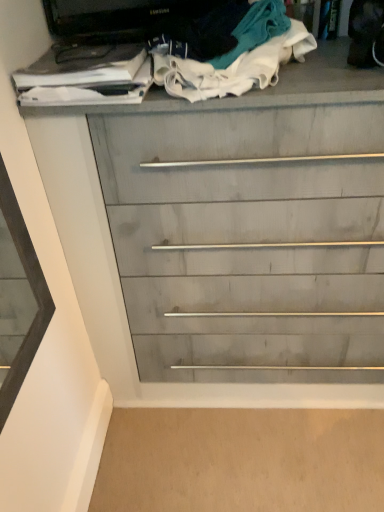
What do you see at coordinates (212, 208) in the screenshot? The width and height of the screenshot is (384, 512). I see `gray wood chest of drawers at center` at bounding box center [212, 208].

This screenshot has height=512, width=384. What are the coordinates of `white cotton cloth at upper center, the first clothing in the right-to-left sequence` in the screenshot? It's located at (235, 56).

Image resolution: width=384 pixels, height=512 pixels. Identify the location of gray wood chest of drawers at center. (212, 208).

From a real-world perspective, is white cotton cloth at upper center, the first clothing in the right-to-left sequence, located beneath gray wood chest of drawers at center?

Actually, white cotton cloth at upper center, the first clothing in the right-to-left sequence, is physically above gray wood chest of drawers at center in the real world.

Can you see white cotton cloth at upper center, arranged as the 2th clothing when viewed from the left, touching gray wood chest of drawers at center?

No, white cotton cloth at upper center, arranged as the 2th clothing when viewed from the left, is not touching gray wood chest of drawers at center.

Is gray wood chest of drawers at center inside white cotton cloth at upper center, arranged as the 2th clothing when viewed from the left?

No, gray wood chest of drawers at center is not surrounded by white cotton cloth at upper center, arranged as the 2th clothing when viewed from the left.

Considering the relative positions of gray wood chest of drawers at center and white cotton cloth at upper center, the first clothing in the right-to-left sequence, in the image provided, is gray wood chest of drawers at center behind white cotton cloth at upper center, the first clothing in the right-to-left sequence,?

Yes, gray wood chest of drawers at center is further from the viewer.

From the image's perspective, does gray wood chest of drawers at center appear higher than white cotton cloth at upper center, arranged as the 2th clothing when viewed from the left?

No, from the image's perspective, gray wood chest of drawers at center is not on top of white cotton cloth at upper center, arranged as the 2th clothing when viewed from the left.

Considering the points (86, 304) and (261, 64), which point is in front, point (86, 304) or point (261, 64)?

The point (261, 64) is more forward.

Is gray wood chest of drawers at center positioned far away from white cotton cloth at upper center, the first clothing in the right-to-left sequence?

No.

In the scene shown: From a real-world perspective, is white cotton socks at upper center, which ranks as the first clothing in left-to-right order, located beneath white cotton cloth at upper center, arranged as the 2th clothing when viewed from the left?

Yes.

From the picture: Is white cotton socks at upper center, which is counted as the 2th clothing, starting from the right, closer to camera compared to white cotton cloth at upper center, arranged as the 2th clothing when viewed from the left?

No, white cotton socks at upper center, which is counted as the 2th clothing, starting from the right, is further to the viewer.

Is point (81, 87) farther from viewer compared to point (242, 52)?

No.

Are white cotton socks at upper center, which is counted as the 2th clothing, starting from the right, and white cotton cloth at upper center, arranged as the 2th clothing when viewed from the left, far apart?

That's not correct — white cotton socks at upper center, which is counted as the 2th clothing, starting from the right, is a little close to white cotton cloth at upper center, arranged as the 2th clothing when viewed from the left.

Considering the sizes of white cotton socks at upper center, which ranks as the first clothing in left-to-right order, and gray wood chest of drawers at center in the image, is white cotton socks at upper center, which ranks as the first clothing in left-to-right order, taller or shorter than gray wood chest of drawers at center?

In the image, white cotton socks at upper center, which ranks as the first clothing in left-to-right order, appears to be shorter than gray wood chest of drawers at center.

From a real-world perspective, who is located higher, white cotton socks at upper center, which is counted as the 2th clothing, starting from the right, or gray wood chest of drawers at center?

white cotton socks at upper center, which is counted as the 2th clothing, starting from the right, is physically above.

Which is nearer, (112, 68) or (287, 120)?

The point (112, 68) is more forward.

Consider the image. Are white cotton socks at upper center, which is counted as the 2th clothing, starting from the right, and gray wood chest of drawers at center located far from each other?

That's not correct — white cotton socks at upper center, which is counted as the 2th clothing, starting from the right, is a little close to gray wood chest of drawers at center.

Considering the relative sizes of gray wood chest of drawers at center and white cotton socks at upper center, which is counted as the 2th clothing, starting from the right, in the image provided, is gray wood chest of drawers at center smaller than white cotton socks at upper center, which is counted as the 2th clothing, starting from the right,?

No.

Is gray wood chest of drawers at center oriented away from white cotton socks at upper center, which is counted as the 2th clothing, starting from the right?

No, gray wood chest of drawers at center is not facing the opposite direction of white cotton socks at upper center, which is counted as the 2th clothing, starting from the right.

Which point is more distant from viewer, (35, 123) or (102, 76)?

The point (35, 123) is farther.

Is point (176, 44) closer to camera compared to point (129, 69)?

No.

Considering the relative positions of white cotton cloth at upper center, the first clothing in the right-to-left sequence, and white cotton socks at upper center, which is counted as the 2th clothing, starting from the right, in the image provided, is white cotton cloth at upper center, the first clothing in the right-to-left sequence, to the left of white cotton socks at upper center, which is counted as the 2th clothing, starting from the right, from the viewer's perspective?

Incorrect, white cotton cloth at upper center, the first clothing in the right-to-left sequence, is not on the left side of white cotton socks at upper center, which is counted as the 2th clothing, starting from the right.

The height and width of the screenshot is (512, 384). Find the location of `clothing that is above the white cotton socks at upper center, which is counted as the 2th clothing, starting from the right (from a real-world perspective)`. clothing that is above the white cotton socks at upper center, which is counted as the 2th clothing, starting from the right (from a real-world perspective) is located at coordinates (235, 56).

From a real-world perspective, who is located lower, white cotton cloth at upper center, arranged as the 2th clothing when viewed from the left, or white cotton socks at upper center, which is counted as the 2th clothing, starting from the right?

white cotton socks at upper center, which is counted as the 2th clothing, starting from the right, is physically lower.

Where is `the 2nd clothing above the gray wood chest of drawers at center (from a real-world perspective)`? the 2nd clothing above the gray wood chest of drawers at center (from a real-world perspective) is located at coordinates (235, 56).

In the image, there is a white cotton cloth at upper center, the first clothing in the right-to-left sequence. Identify the location of the chest of drawers below it (from a real-world perspective). The image size is (384, 512). (212, 208).

Looking at the image, which one is located closer to gray wood chest of drawers at center, white cotton cloth at upper center, arranged as the 2th clothing when viewed from the left, or white cotton socks at upper center, which is counted as the 2th clothing, starting from the right?

Based on the image, white cotton cloth at upper center, arranged as the 2th clothing when viewed from the left, appears to be nearer to gray wood chest of drawers at center.

In the scene shown: When comparing their distances from white cotton socks at upper center, which ranks as the first clothing in left-to-right order, does gray wood chest of drawers at center or white cotton cloth at upper center, arranged as the 2th clothing when viewed from the left, seem further?

The object further to white cotton socks at upper center, which ranks as the first clothing in left-to-right order, is gray wood chest of drawers at center.

In the scene shown: When comparing their distances from white cotton cloth at upper center, arranged as the 2th clothing when viewed from the left, does white cotton socks at upper center, which ranks as the first clothing in left-to-right order, or gray wood chest of drawers at center seem further?

gray wood chest of drawers at center.

Estimate the real-world distances between objects in this image. Which object is closer to white cotton socks at upper center, which is counted as the 2th clothing, starting from the right, white cotton cloth at upper center, the first clothing in the right-to-left sequence, or gray wood chest of drawers at center?

Based on the image, white cotton cloth at upper center, the first clothing in the right-to-left sequence, appears to be nearer to white cotton socks at upper center, which is counted as the 2th clothing, starting from the right.

Looking at the image, which one is located closer to white cotton cloth at upper center, arranged as the 2th clothing when viewed from the left, gray wood chest of drawers at center or white cotton socks at upper center, which is counted as the 2th clothing, starting from the right?

white cotton socks at upper center, which is counted as the 2th clothing, starting from the right, lies closer to white cotton cloth at upper center, arranged as the 2th clothing when viewed from the left, than the other object.

Which object lies further to the anchor point gray wood chest of drawers at center, white cotton socks at upper center, which ranks as the first clothing in left-to-right order, or white cotton cloth at upper center, the first clothing in the right-to-left sequence?

Based on the image, white cotton socks at upper center, which ranks as the first clothing in left-to-right order, appears to be further to gray wood chest of drawers at center.

The height and width of the screenshot is (512, 384). I want to click on clothing situated between white cotton socks at upper center, which is counted as the 2th clothing, starting from the right, and gray wood chest of drawers at center from left to right, so click(x=235, y=56).